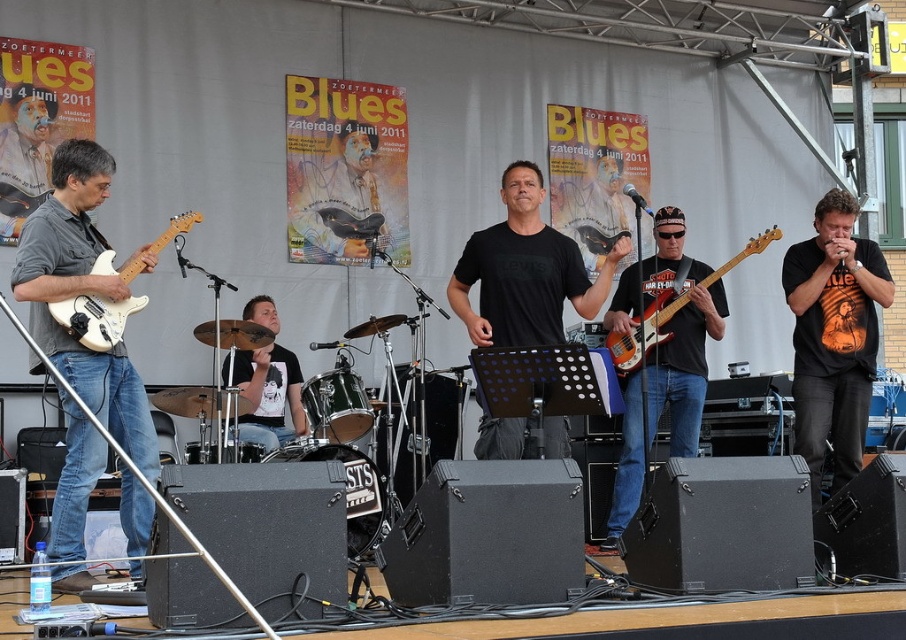
Based on the photo, which of these two, matte black guitar at center or matte black bass guitar at center, stands shorter?

With less height is matte black guitar at center.

Who is more distant from viewer, (448, 288) or (657, 413)?

Positioned behind is point (657, 413).

Is point (101, 186) positioned after point (680, 324)?

No, (101, 186) is in front of (680, 324).

Identify the location of matte black guitar at center. The height and width of the screenshot is (640, 906). (522, 196).

Is point (707, 291) farther from viewer compared to point (295, 392)?

That is False.

Between point (612, 264) and point (258, 410), which one is positioned behind?

The point (258, 410) is behind.

Identify the location of matte black guitar at center. The width and height of the screenshot is (906, 640). (522, 196).

Does point (76, 378) come closer to viewer compared to point (609, 276)?

Yes, point (76, 378) is in front of point (609, 276).

Which is behind, point (85, 227) or point (524, 253)?

Positioned behind is point (524, 253).

Does point (156, 477) come closer to viewer compared to point (519, 259)?

Yes, it is in front of point (519, 259).

Identify the location of matte white guitar at left. This screenshot has width=906, height=640. (74, 339).